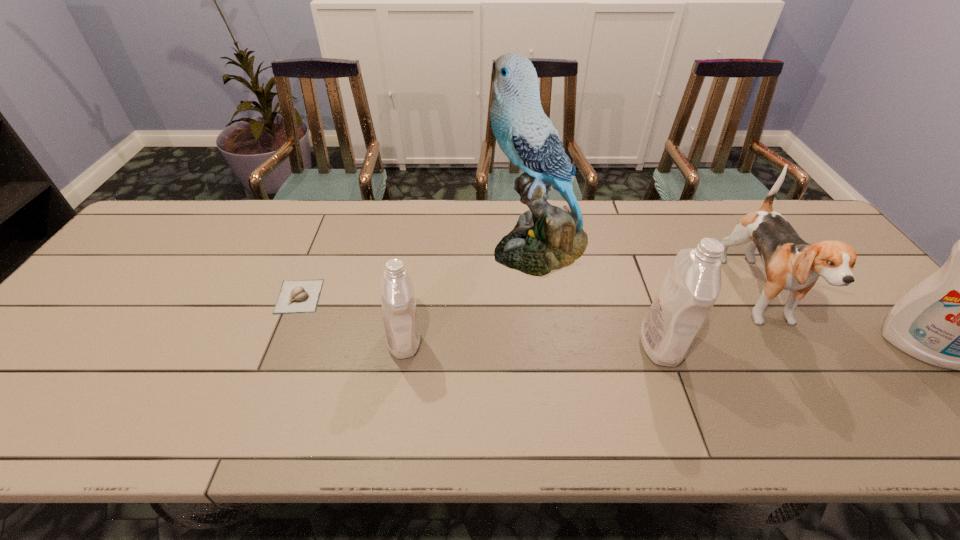
Locate an element on the screen. the fifth tallest object is located at coordinates (402, 336).

Where is `the shortest detergent`? The width and height of the screenshot is (960, 540). the shortest detergent is located at coordinates (402, 336).

Find the location of a particular element. This screenshot has height=540, width=960. the second detergent from right to left is located at coordinates (692, 284).

The height and width of the screenshot is (540, 960). Find the location of `the fourth object from left to right`. the fourth object from left to right is located at coordinates (692, 284).

The height and width of the screenshot is (540, 960). Identify the location of the tallest object. (546, 238).

You are a GUI agent. You are given a task and a screenshot of the screen. Output one action in this format:
    pyautogui.click(x=<x>, y=<y>)
    Task: Click on the parakeet
    The height and width of the screenshot is (540, 960).
    Given the screenshot: What is the action you would take?
    pyautogui.click(x=546, y=238)

Where is `the shortest object`? The width and height of the screenshot is (960, 540). the shortest object is located at coordinates (301, 296).

You are a GUI agent. You are given a task and a screenshot of the screen. Output one action in this format:
    pyautogui.click(x=<x>, y=<y>)
    Task: Click on the garlic
    This screenshot has height=540, width=960.
    Given the screenshot: What is the action you would take?
    pyautogui.click(x=301, y=296)

Where is `the second object from right to left`? the second object from right to left is located at coordinates (790, 263).

In order to click on free point located 0.290m on the right of the second object from left to right in this screenshot , I will do `click(542, 341)`.